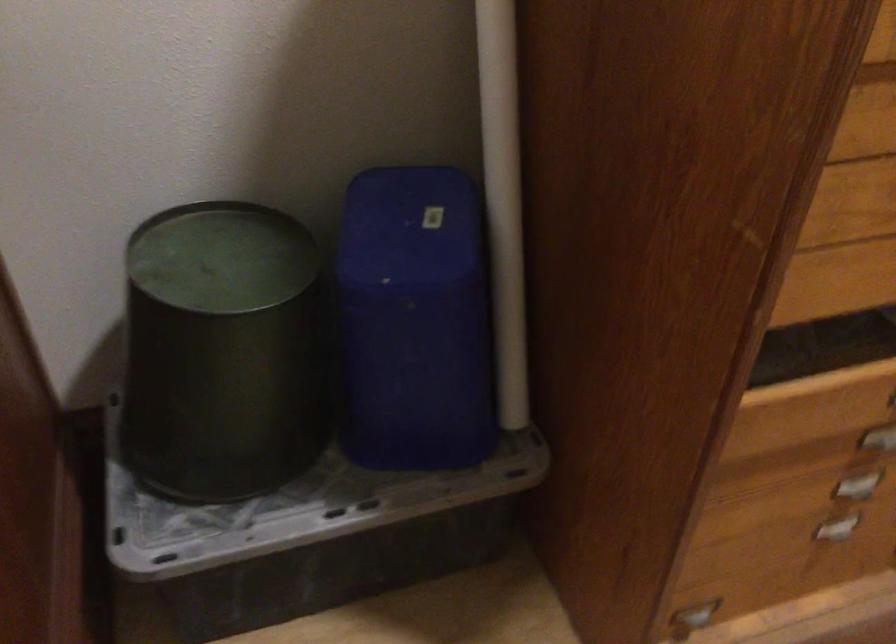
Describe the element at coordinates (414, 321) in the screenshot. The height and width of the screenshot is (644, 896). I see `a blue plastic bin` at that location.